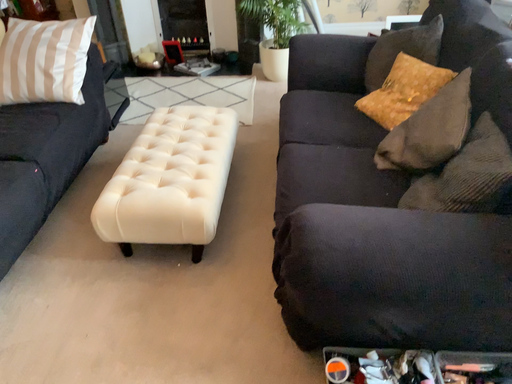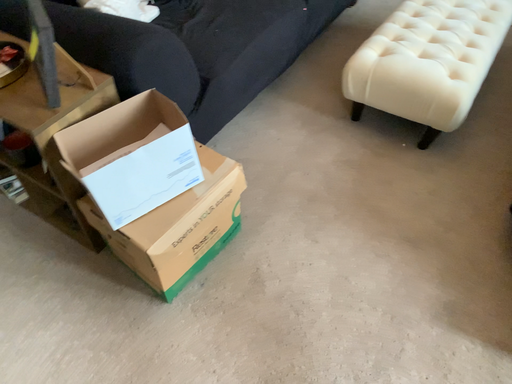
Question: How did the camera likely rotate when shooting the video?

Choices:
 (A) rotated right
 (B) rotated left

Answer: (B)